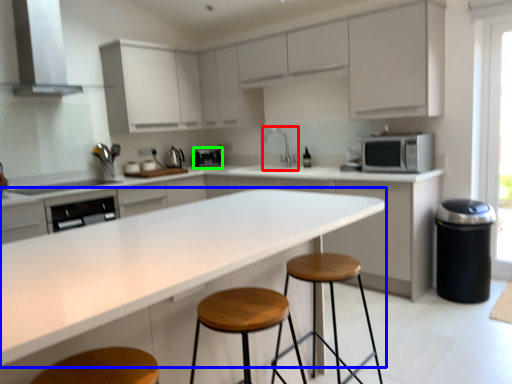
Question: Based on their relative distances, which object is farther from sink (highlighted by a red box)? Choose from countertop (highlighted by a blue box) and appliance (highlighted by a green box).

Choices:
 (A) countertop
 (B) appliance

Answer: (A)